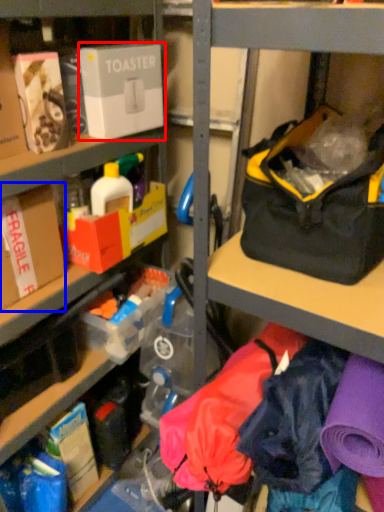
Question: Which object appears closest to the camera in this image, box (highlighted by a red box) or box (highlighted by a blue box)?

Choices:
 (A) box
 (B) box

Answer: (B)